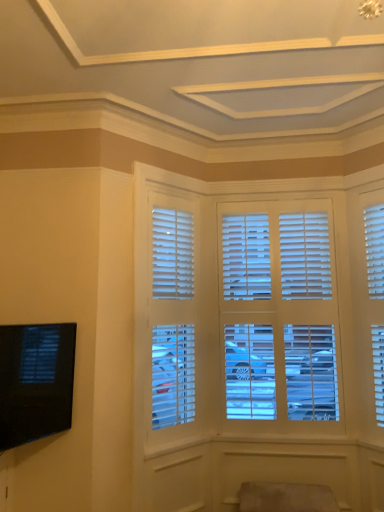
Question: Is white matte blinds at center inside suede-like beige swivel chair at lower center?

Choices:
 (A) no
 (B) yes

Answer: (A)

Question: From the image's perspective, does suede-like beige swivel chair at lower center appear higher than white matte blinds at center?

Choices:
 (A) yes
 (B) no

Answer: (B)

Question: Can you confirm if suede-like beige swivel chair at lower center is thinner than white matte blinds at center?

Choices:
 (A) yes
 (B) no

Answer: (B)

Question: Is suede-like beige swivel chair at lower center to the left of white matte blinds at center from the viewer's perspective?

Choices:
 (A) no
 (B) yes

Answer: (A)

Question: Is suede-like beige swivel chair at lower center touching white matte blinds at center?

Choices:
 (A) no
 (B) yes

Answer: (A)

Question: Can you confirm if suede-like beige swivel chair at lower center is taller than white matte blinds at center?

Choices:
 (A) yes
 (B) no

Answer: (B)

Question: Is black glossy tv at lower left beside suede-like beige swivel chair at lower center?

Choices:
 (A) no
 (B) yes

Answer: (A)

Question: Is black glossy tv at lower left positioned far away from suede-like beige swivel chair at lower center?

Choices:
 (A) yes
 (B) no

Answer: (A)

Question: Is black glossy tv at lower left closer to the viewer compared to suede-like beige swivel chair at lower center?

Choices:
 (A) no
 (B) yes

Answer: (B)

Question: Is suede-like beige swivel chair at lower center a part of black glossy tv at lower left?

Choices:
 (A) yes
 (B) no

Answer: (B)

Question: Can you confirm if black glossy tv at lower left is smaller than suede-like beige swivel chair at lower center?

Choices:
 (A) yes
 (B) no

Answer: (A)

Question: Can we say black glossy tv at lower left lies outside suede-like beige swivel chair at lower center?

Choices:
 (A) no
 (B) yes

Answer: (B)

Question: From the image's perspective, is white matte blinds at center above black glossy tv at lower left?

Choices:
 (A) no
 (B) yes

Answer: (B)